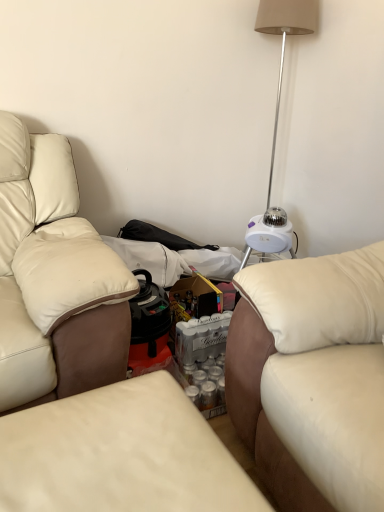
Question: Does leather couch at center, marked as the second studio couch in a right-to-left arrangement, have a greater width compared to white plastic table lamp at upper right?

Choices:
 (A) yes
 (B) no

Answer: (A)

Question: Considering the relative sizes of leather couch at center, marked as the second studio couch in a right-to-left arrangement, and white plastic table lamp at upper right in the image provided, is leather couch at center, marked as the second studio couch in a right-to-left arrangement, taller than white plastic table lamp at upper right?

Choices:
 (A) yes
 (B) no

Answer: (B)

Question: Considering the relative sizes of leather couch at center, which ranks as the 1th studio couch in left-to-right order, and white plastic table lamp at upper right in the image provided, is leather couch at center, which ranks as the 1th studio couch in left-to-right order, smaller than white plastic table lamp at upper right?

Choices:
 (A) no
 (B) yes

Answer: (B)

Question: From a real-world perspective, is leather couch at center, marked as the second studio couch in a right-to-left arrangement, located beneath white plastic table lamp at upper right?

Choices:
 (A) yes
 (B) no

Answer: (A)

Question: Is leather couch at center, which ranks as the 1th studio couch in left-to-right order, positioned before white plastic table lamp at upper right?

Choices:
 (A) yes
 (B) no

Answer: (A)

Question: From a real-world perspective, is leather couch at center, marked as the second studio couch in a right-to-left arrangement, positioned above or below white plastic table lamp at upper right?

Choices:
 (A) below
 (B) above

Answer: (A)

Question: Does point (31, 474) appear closer or farther from the camera than point (311, 18)?

Choices:
 (A) closer
 (B) farther

Answer: (A)

Question: In the image, is leather couch at center, marked as the second studio couch in a right-to-left arrangement, positioned in front of or behind white plastic table lamp at upper right?

Choices:
 (A) behind
 (B) front

Answer: (B)

Question: From their relative heights in the image, would you say leather couch at center, which ranks as the 1th studio couch in left-to-right order, is taller or shorter than white plastic table lamp at upper right?

Choices:
 (A) short
 (B) tall

Answer: (A)

Question: Considering their positions, is white plastic table lamp at upper right located in front of or behind white leather studio couch at right, the first studio couch in the right-to-left sequence?

Choices:
 (A) front
 (B) behind

Answer: (B)

Question: From a real-world perspective, relative to white leather studio couch at right, the first studio couch in the right-to-left sequence, is white plastic table lamp at upper right vertically above or below?

Choices:
 (A) above
 (B) below

Answer: (A)

Question: From the image's perspective, is white plastic table lamp at upper right located above or below white leather studio couch at right, the second studio couch viewed from the left?

Choices:
 (A) above
 (B) below

Answer: (A)

Question: In the image, is white plastic table lamp at upper right on the left side or the right side of white leather studio couch at right, the first studio couch in the right-to-left sequence?

Choices:
 (A) right
 (B) left

Answer: (B)

Question: From the image's perspective, is white leather studio couch at right, the second studio couch viewed from the left, positioned above or below leather couch at center, which ranks as the 1th studio couch in left-to-right order?

Choices:
 (A) above
 (B) below

Answer: (A)

Question: Looking at their shapes, would you say white leather studio couch at right, the second studio couch viewed from the left, is wider or thinner than leather couch at center, marked as the second studio couch in a right-to-left arrangement?

Choices:
 (A) thin
 (B) wide

Answer: (B)